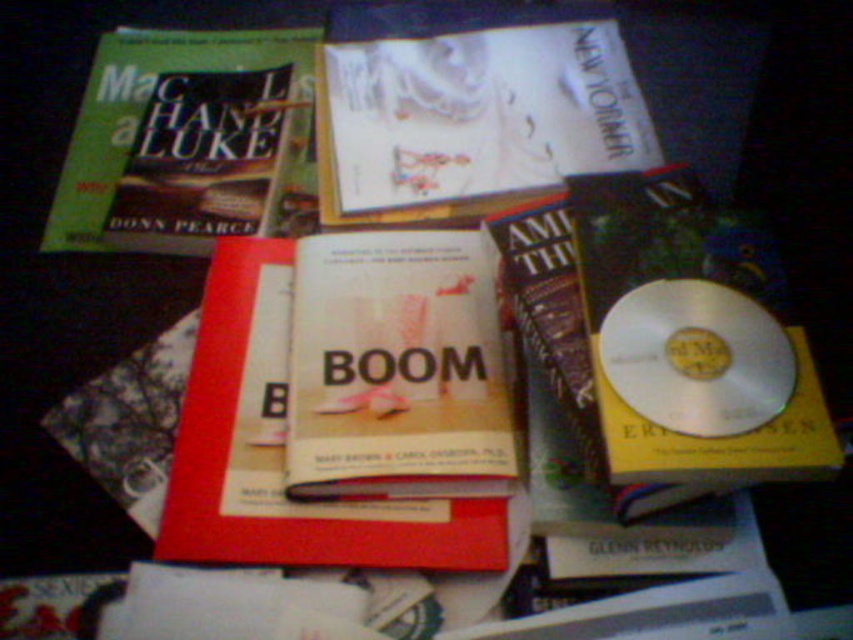
You are organizing items on a desk and need to place the white paper magazine at upper center and the green matte book at upper left. Which item requires more desk space due to its size?

The white paper magazine at upper center requires more desk space because it is bigger than the green matte book at upper left.

You are organizing items on a desk and need to place a new item between the white paper magazine at upper center and the hardcover book at center. Based on their positions, which item is on the left side to determine where to place the new item?

The hardcover book at center is on the left side of the white paper magazine at upper center. Therefore, you should place the new item between them by positioning it to the right of the hardcover book at center and to the left of the white paper magazine at upper center.